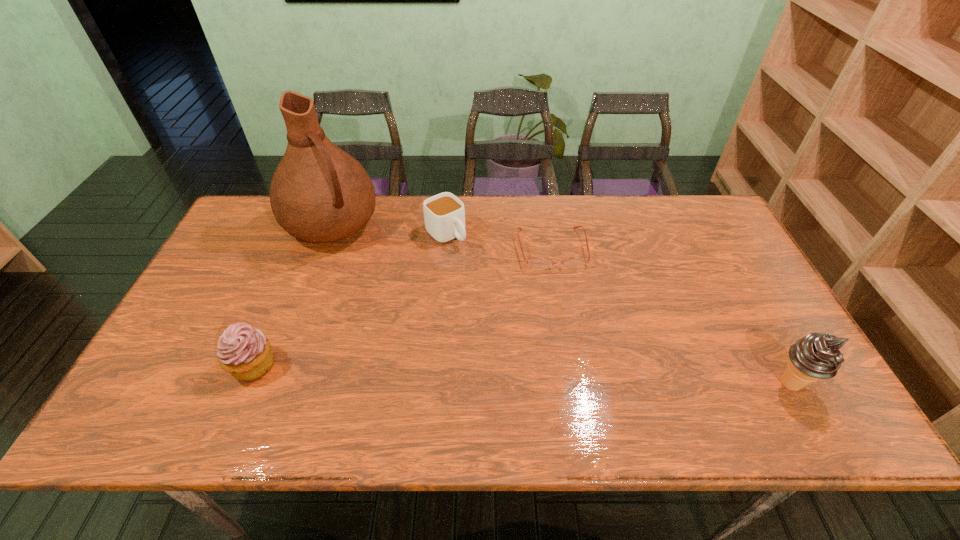
Where is `vacant region at the left edge`? The height and width of the screenshot is (540, 960). vacant region at the left edge is located at coordinates (263, 244).

Locate an element on the screen. vacant area at the far left corner of the desktop is located at coordinates (234, 228).

Identify the location of free space at the near right corner of the desktop. This screenshot has width=960, height=540. (809, 385).

I want to click on vacant area that lies between the cupcake and the tallest object, so click(x=293, y=295).

Image resolution: width=960 pixels, height=540 pixels. What are the coordinates of `vacant area that lies between the cupcake and the fourth object from left to right` in the screenshot? It's located at (402, 307).

The height and width of the screenshot is (540, 960). Identify the location of vacant region between the second tallest object and the second shortest object. (618, 309).

At what (x,y) coordinates should I click in order to perform the action: click on blank region between the cupcake and the third object from right to left. Please return your answer as a coordinate pair (x, y). Image resolution: width=960 pixels, height=540 pixels. Looking at the image, I should click on (349, 300).

At what (x,y) coordinates should I click in order to perform the action: click on blank region between the pitcher and the second shortest object. Please return your answer as a coordinate pair (x, y). This screenshot has height=540, width=960. Looking at the image, I should click on (389, 230).

Find the location of a particular element. free space between the third object from right to left and the second object from right to left is located at coordinates (499, 241).

This screenshot has width=960, height=540. What are the coordinates of `vacant space in between the fourth object from left to right and the cupcake` in the screenshot? It's located at (402, 307).